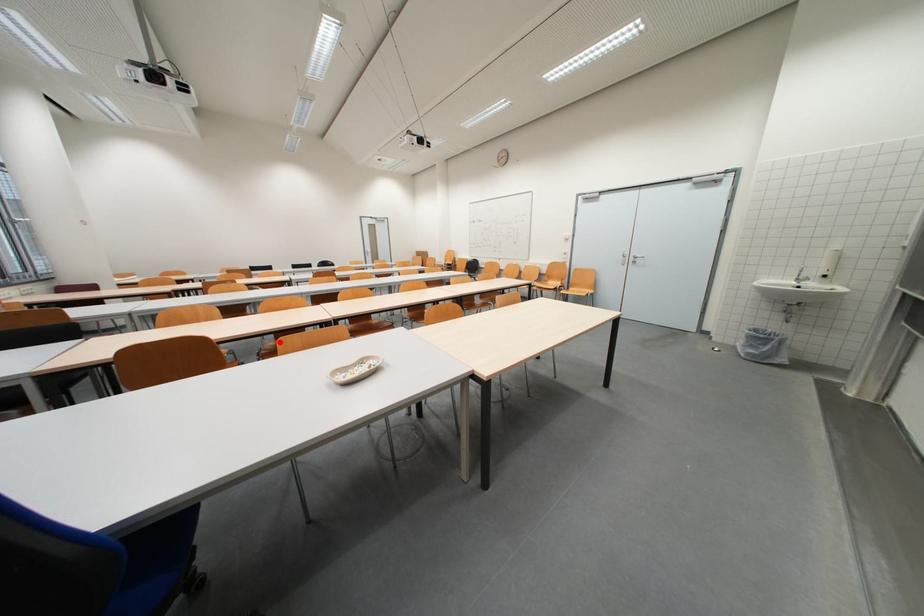
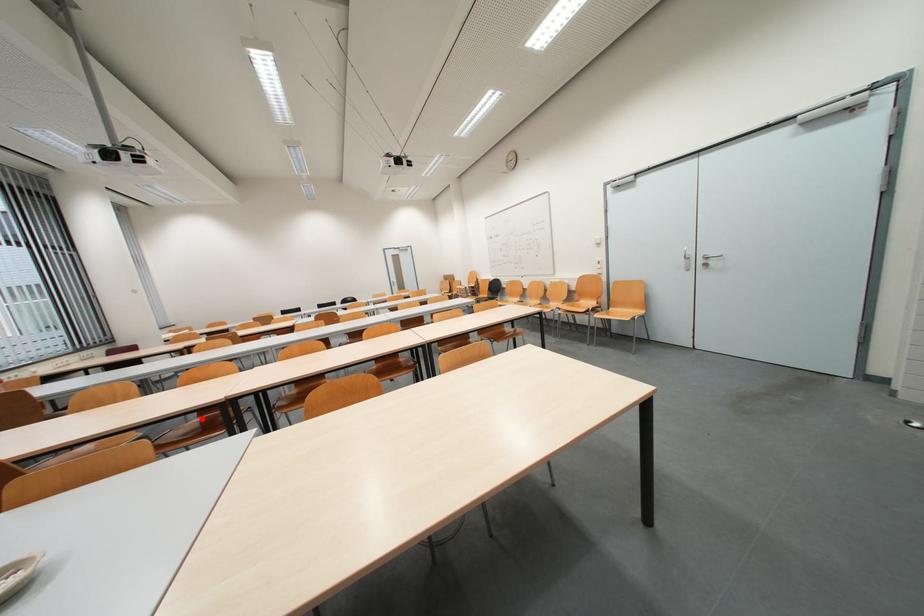
I am providing you with two images of the same scene from different viewpoints. A red point is marked on the first image and another point is marked on the second image. Do the highlighted points in image1 and image2 indicate the same real-world spot?

Yes